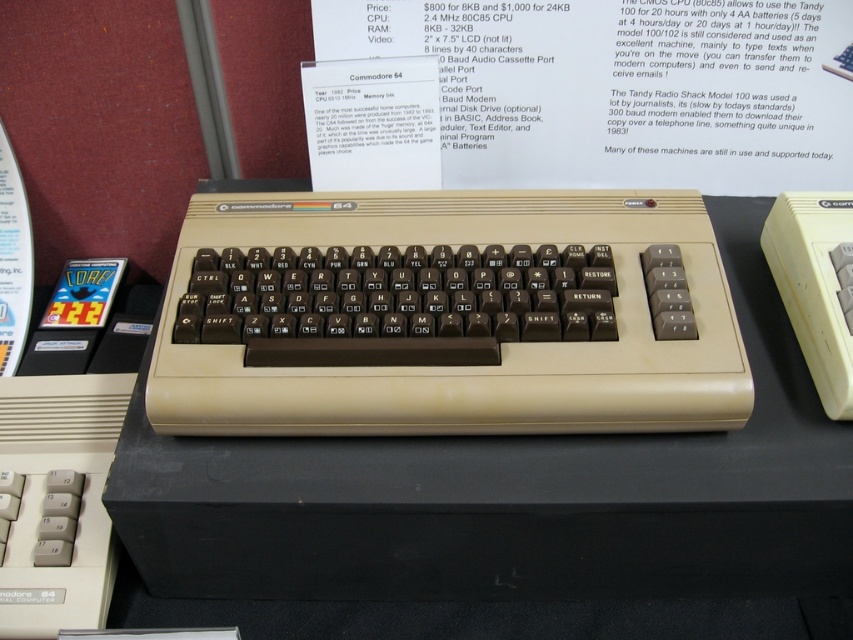
Question: Does beige plastic keyboard at center appear under beige plastic table at center?

Choices:
 (A) no
 (B) yes

Answer: (A)

Question: Can you confirm if beige plastic keyboard at center is positioned above beige plastic table at center?

Choices:
 (A) yes
 (B) no

Answer: (A)

Question: Observing the image, what is the correct spatial positioning of beige plastic keyboard at center in reference to beige plastic table at center?

Choices:
 (A) right
 (B) left

Answer: (B)

Question: Which of the following is the closest to the observer?

Choices:
 (A) (804, 566)
 (B) (456, 426)

Answer: (B)

Question: Which object appears closest to the camera in this image?

Choices:
 (A) beige plastic table at center
 (B) beige plastic keyboard at center

Answer: (A)

Question: Which of the following is the farthest from the observer?

Choices:
 (A) beige plastic table at center
 (B) beige plastic keyboard at center

Answer: (B)